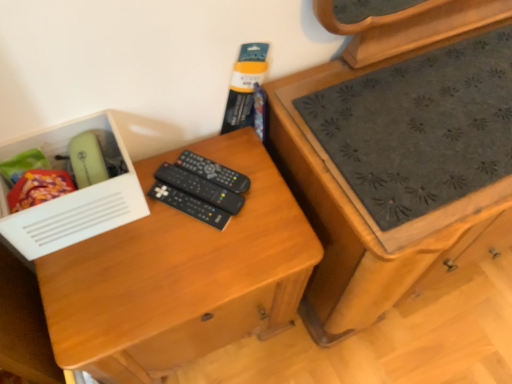
Question: Is point (243, 201) closer or farther from the camera than point (150, 192)?

Choices:
 (A) closer
 (B) farther

Answer: (A)

Question: Considering the relative positions of black plastic remote controls at center, which is the 2th remote control from top to bottom, and black plastic remote controls at center, acting as the 3th remote control starting from the top, in the image provided, is black plastic remote controls at center, which is the 2th remote control from top to bottom, to the left or to the right of black plastic remote controls at center, acting as the 3th remote control starting from the top,?

Choices:
 (A) left
 (B) right

Answer: (B)

Question: Which object is positioned closest to the wooden chest of drawers at right?

Choices:
 (A) black plastic remote controls at center, which is counted as the 1th remote control, starting from the top
 (B) black plastic remote controls at center, acting as the 3th remote control starting from the top
 (C) black plastic remote controls at center, the second remote control positioned from the bottom
 (D) white plastic box at left
 (E) wooden desk at center

Answer: (E)

Question: Estimate the real-world distances between objects in this image. Which object is farther from the wooden chest of drawers at right?

Choices:
 (A) white plastic box at left
 (B) wooden desk at center
 (C) black plastic remote controls at center, which is the 2th remote control from top to bottom
 (D) black plastic remote controls at center, which ranks as the 1th remote control in bottom-to-top order
 (E) black plastic remote controls at center, positioned as the third remote control in bottom-to-top order

Answer: (A)